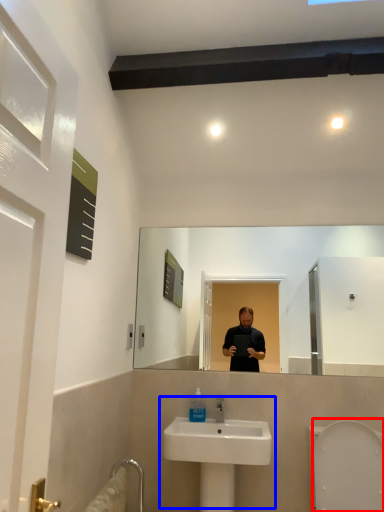
Question: Which point is further to the camera, bidet (highlighted by a red box) or sink (highlighted by a blue box)?

Choices:
 (A) bidet
 (B) sink

Answer: (B)